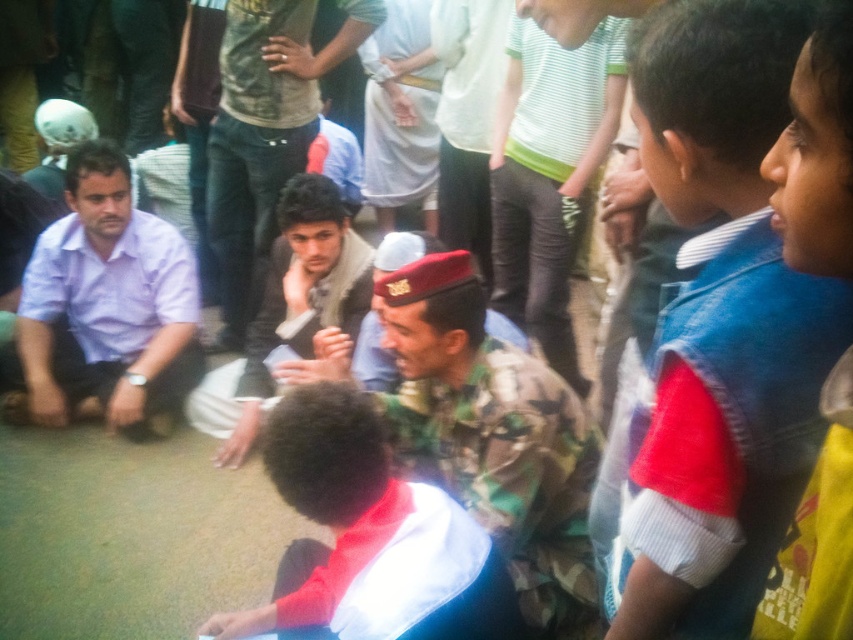
You are a photographer trying to capture a group photo of the dark gray jacket at center and the camouflage uniform at center. Which one should you focus on to ensure it appears larger in the photo?

The dark gray jacket at center is taller than the camouflage uniform at center, so focusing on it will make it appear larger in the photo.

You are standing at the origin point in the image and want to reach the point at coordinates point (354, 51). Is the point at coordinates point (329, 192) in front of or behind your path to your destination?

The point at coordinates point (329, 192) is in front of your path to the point at coordinates point (354, 51) since point (354, 51) is behind point (329, 192).